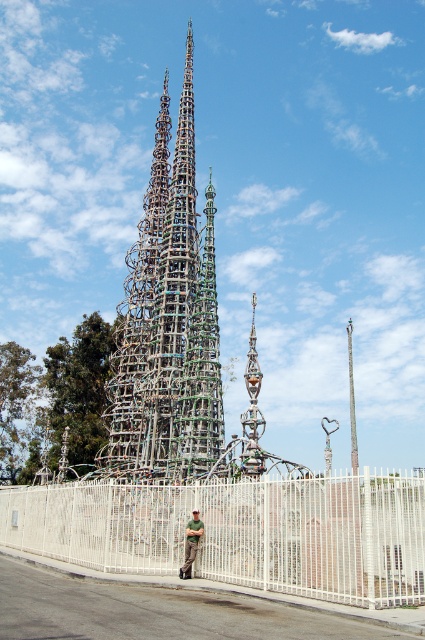
Which is behind, point (71, 496) or point (78, 433)?

The point (78, 433) is more distant.

Does white metal fence at lower center appear under green leafy tree at center?

Yes.

The height and width of the screenshot is (640, 425). What are the coordinates of `white metal fence at lower center` in the screenshot? It's located at (238, 531).

What do you see at coordinates (79, 387) in the screenshot?
I see `green leafy tree at center` at bounding box center [79, 387].

Who is higher up, green leafy tree at center or green matte shirt at center?

green leafy tree at center is above.

Locate an element on the screen. The height and width of the screenshot is (640, 425). green leafy tree at center is located at coordinates (79, 387).

Is point (285, 497) closer to camera compared to point (17, 376)?

Yes, it is.

Can you confirm if white metal fence at lower center is smaller than green leafy tree at left?

No, white metal fence at lower center is not smaller than green leafy tree at left.

Image resolution: width=425 pixels, height=640 pixels. I want to click on white metal fence at lower center, so click(238, 531).